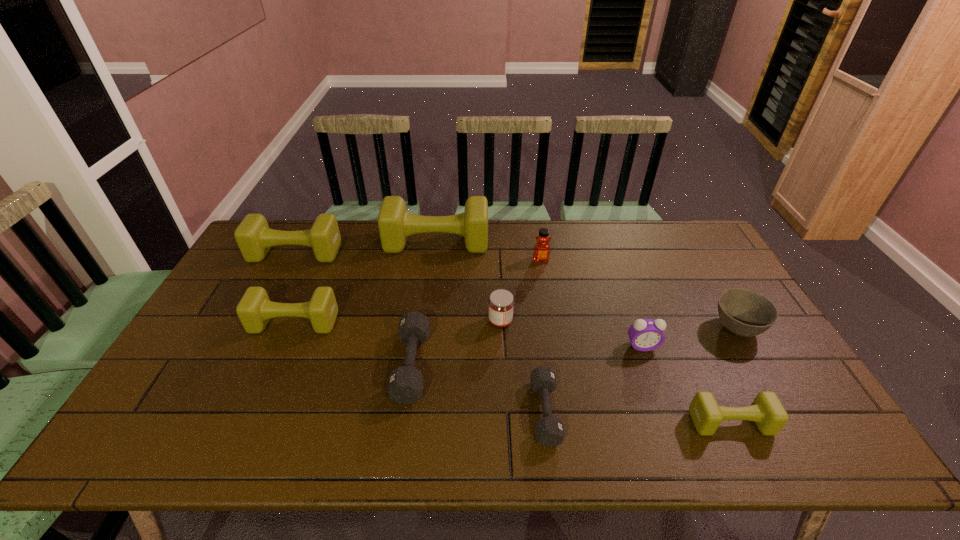
I want to click on the tallest object, so click(x=395, y=224).

Where is `the second olive dumbbell from right to left`? The width and height of the screenshot is (960, 540). the second olive dumbbell from right to left is located at coordinates (395, 224).

Identify the location of the second tallest dumbbell. This screenshot has width=960, height=540. (254, 237).

Identify the location of honey. (541, 253).

Locate an element on the screen. the second smallest olive dumbbell is located at coordinates (254, 310).

Image resolution: width=960 pixels, height=540 pixels. I want to click on the second nearest olive dumbbell, so click(254, 310).

Locate an element on the screen. Image resolution: width=960 pixels, height=540 pixels. red jam is located at coordinates (501, 303).

Identify the location of the eighth object from left to right. (645, 334).

Where is `bowl`? Image resolution: width=960 pixels, height=540 pixels. bowl is located at coordinates (744, 312).

Image resolution: width=960 pixels, height=540 pixels. What are the coordinates of `the left gray dumbbell` in the screenshot? It's located at (405, 384).